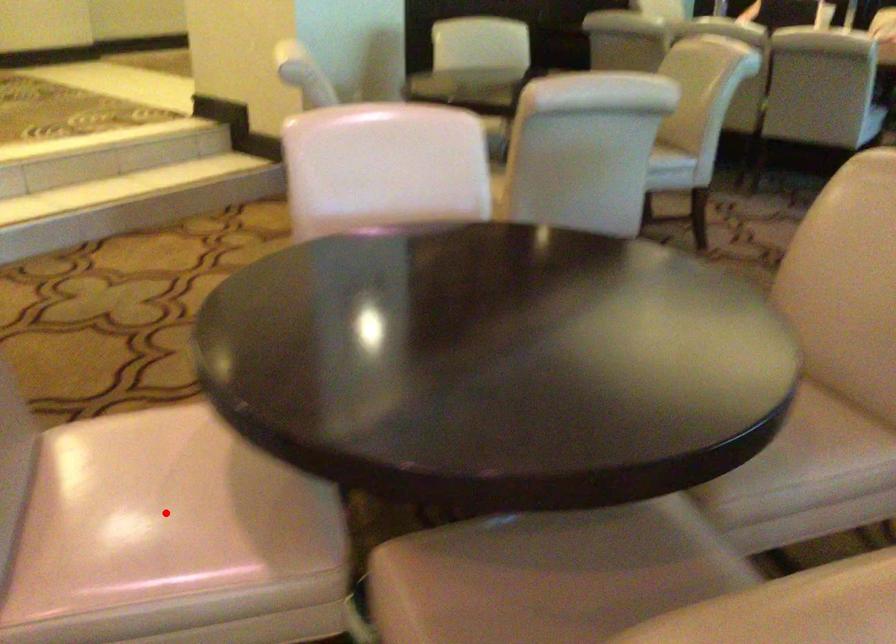
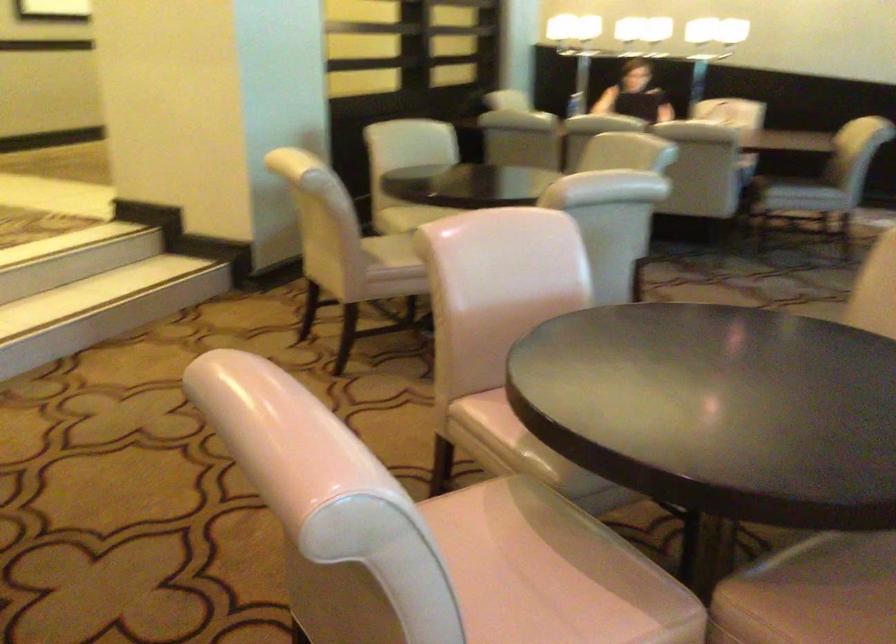
Question: I am providing you with two images of the same scene from different viewpoints. Image1 has a red point marked. In image2, the corresponding 3D location appears at what relative position? Reply with the corresponding letter.

Choices:
 (A) Closer
 (B) Farther

Answer: (B)